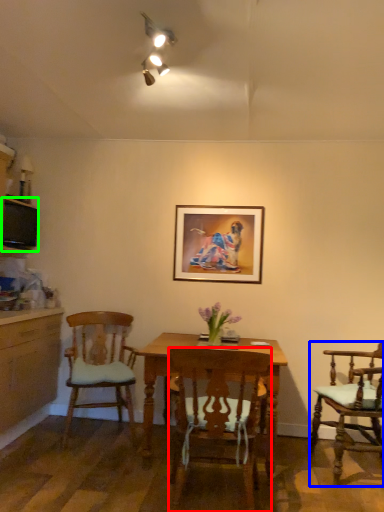
Question: Which object is the farthest from chair (highlighted by a red box)? Choose among these: chair (highlighted by a blue box) or television (highlighted by a green box).

Choices:
 (A) chair
 (B) television

Answer: (B)